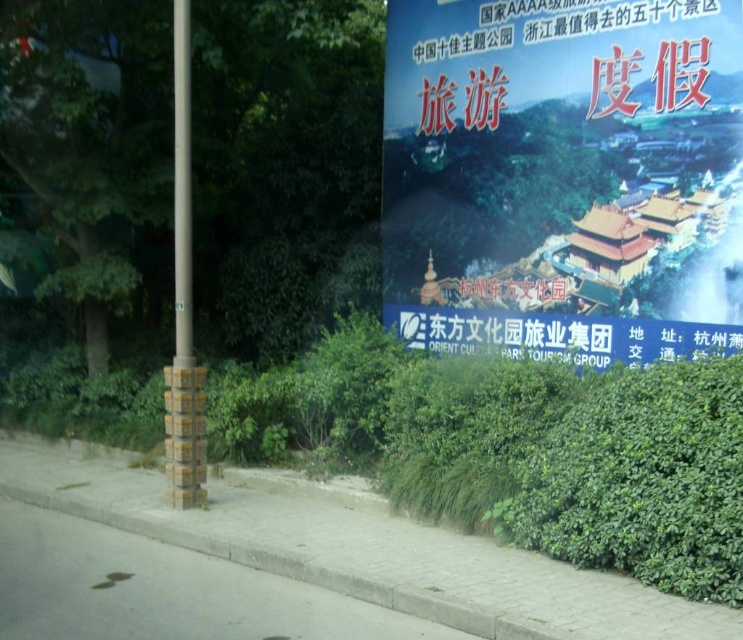
Does blue glossy poster at upper right have a lesser width compared to yellow painted metal pole at left?

Incorrect, blue glossy poster at upper right's width is not less than yellow painted metal pole at left's.

Is blue glossy poster at upper right bigger than yellow painted metal pole at left?

Indeed, blue glossy poster at upper right has a larger size compared to yellow painted metal pole at left.

Locate an element on the screen. The image size is (743, 640). blue glossy poster at upper right is located at coordinates (564, 177).

Locate an element on the screen. blue glossy poster at upper right is located at coordinates (564, 177).

The image size is (743, 640). Describe the element at coordinates (357, 548) in the screenshot. I see `gray concrete pavement at lower center` at that location.

Between gray concrete pavement at lower center and yellow painted metal pole at left, which one has less height?

With less height is gray concrete pavement at lower center.

Who is more forward, (233, 476) or (188, 500)?

Positioned in front is point (188, 500).

Locate an element on the screen. This screenshot has width=743, height=640. gray concrete pavement at lower center is located at coordinates (357, 548).

Is blue glossy poster at upper right positioned before gray concrete pavement at lower center?

No, blue glossy poster at upper right is further to the viewer.

Is blue glossy poster at upper right below gray concrete pavement at lower center?

Incorrect, blue glossy poster at upper right is not positioned below gray concrete pavement at lower center.

Locate an element on the screen. The height and width of the screenshot is (640, 743). blue glossy poster at upper right is located at coordinates (564, 177).